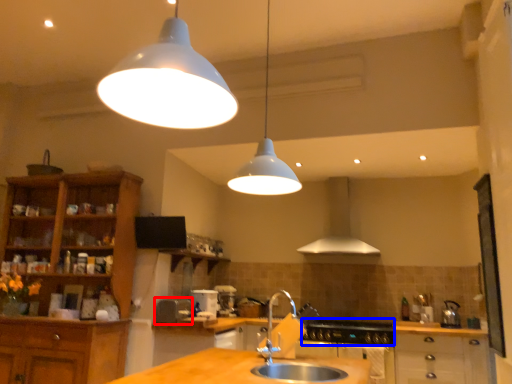
Question: Which object appears farthest to the camera in this image, appliance (highlighted by a red box) or gas stove (highlighted by a blue box)?

Choices:
 (A) appliance
 (B) gas stove

Answer: (B)